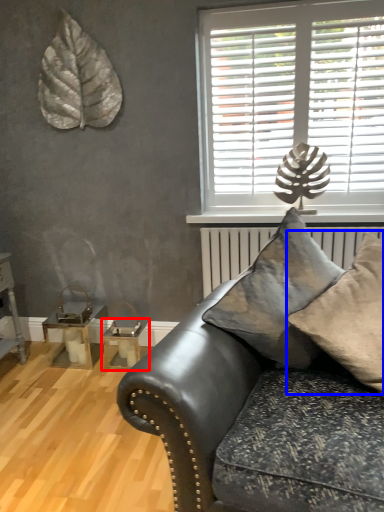
Question: Which object appears closest to the camera in this image, table (highlighted by a red box) or pillow (highlighted by a blue box)?

Choices:
 (A) table
 (B) pillow

Answer: (B)